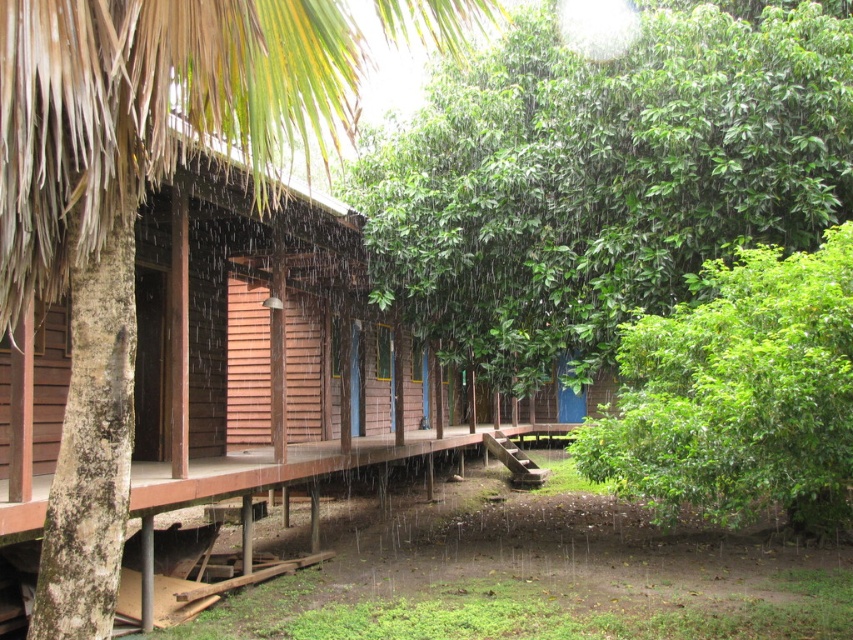
Question: Considering the real-world distances, which object is closest to the brown textured palm leaf at upper left?

Choices:
 (A) green leafy tree at center
 (B) green leafy bush at right

Answer: (B)

Question: Among these objects, which one is nearest to the camera?

Choices:
 (A) green leafy tree at center
 (B) brown textured palm leaf at upper left

Answer: (B)

Question: Observing the image, what is the correct spatial positioning of green leafy tree at center in reference to green leafy bush at right?

Choices:
 (A) left
 (B) right

Answer: (A)

Question: Can you confirm if brown textured palm leaf at upper left is positioned below green leafy bush at right?

Choices:
 (A) yes
 (B) no

Answer: (B)

Question: From the image, what is the correct spatial relationship of brown textured palm leaf at upper left in relation to green leafy bush at right?

Choices:
 (A) right
 (B) left

Answer: (B)

Question: Which of the following is the closest to the observer?

Choices:
 (A) brown textured palm leaf at upper left
 (B) green leafy bush at right

Answer: (A)